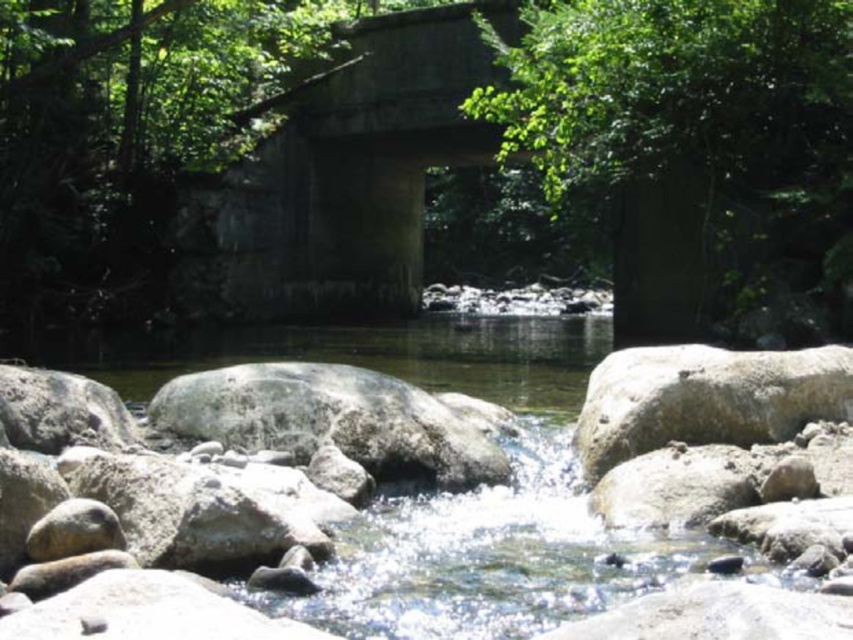
Question: Does green leafy tree at center have a lesser width compared to gray rough boulder at right?

Choices:
 (A) no
 (B) yes

Answer: (A)

Question: Does green leafy tree at center have a smaller size compared to gray rough boulder at right?

Choices:
 (A) no
 (B) yes

Answer: (A)

Question: Does green leafy tree at center lie in front of gray rough boulder at right?

Choices:
 (A) no
 (B) yes

Answer: (A)

Question: Which point is closer to the camera taking this photo?

Choices:
 (A) (592, 460)
 (B) (540, 44)

Answer: (A)

Question: Among these points, which one is nearest to the camera?

Choices:
 (A) (585, 406)
 (B) (833, 257)

Answer: (A)